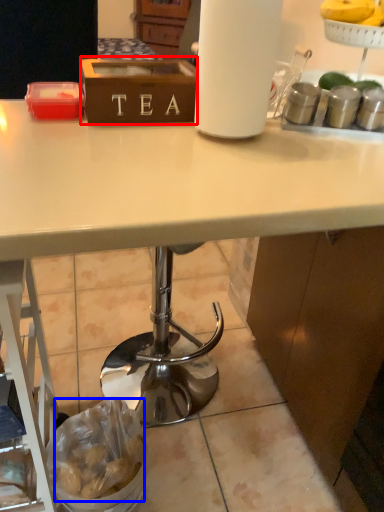
Question: Which point is closer to the camera, box (highlighted by a red box) or food (highlighted by a blue box)?

Choices:
 (A) box
 (B) food

Answer: (A)